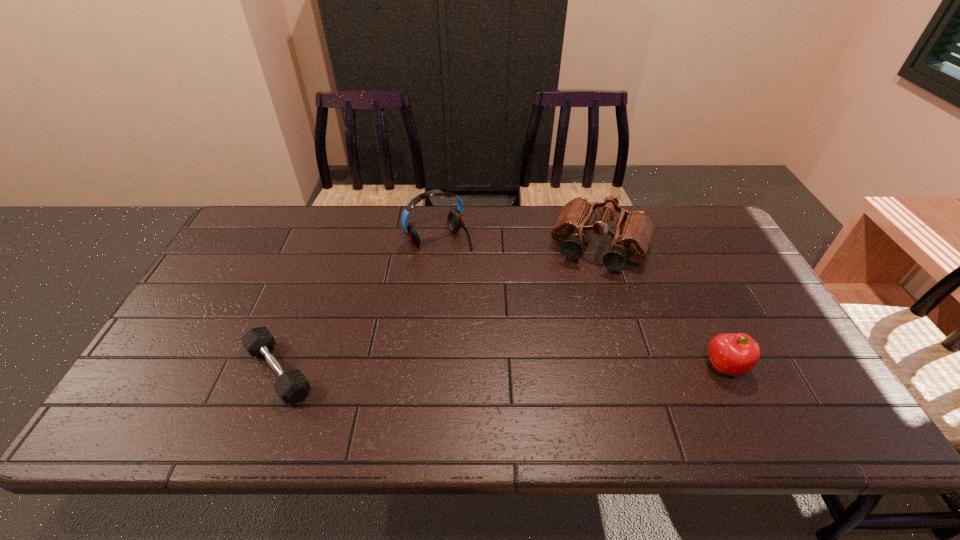
Image resolution: width=960 pixels, height=540 pixels. What are the coordinates of `blank space that satisfies the following two spatial constraints: 1. on the front side of the third shortest object; 2. on the left side of the second object from left to right` in the screenshot? It's located at (439, 248).

You are a GUI agent. You are given a task and a screenshot of the screen. Output one action in this format:
    pyautogui.click(x=<x>, y=<y>)
    Task: Click on the vacant space that satisfies the following two spatial constraints: 1. on the back side of the second tallest object; 2. on the right side of the shortest object
    
    Given the screenshot: What is the action you would take?
    pyautogui.click(x=326, y=248)